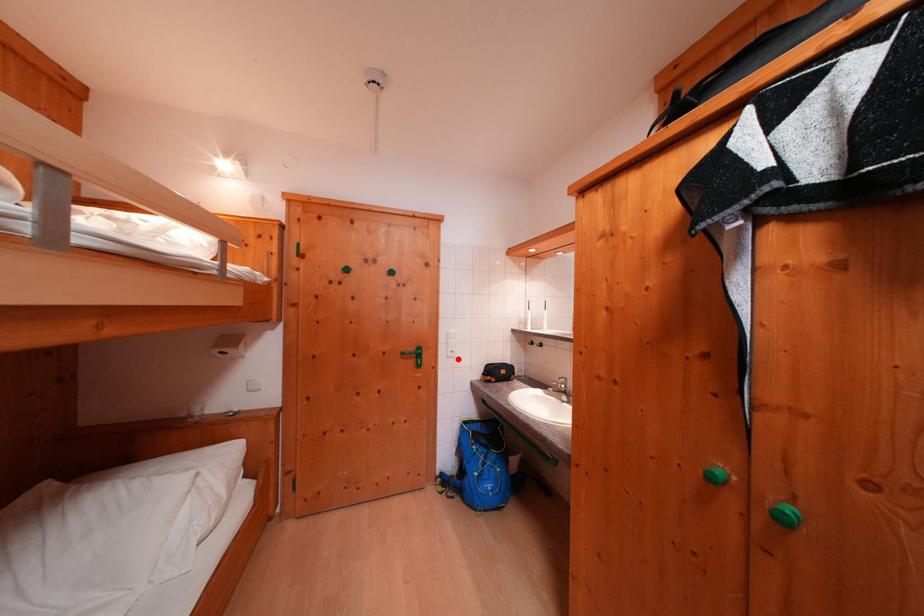
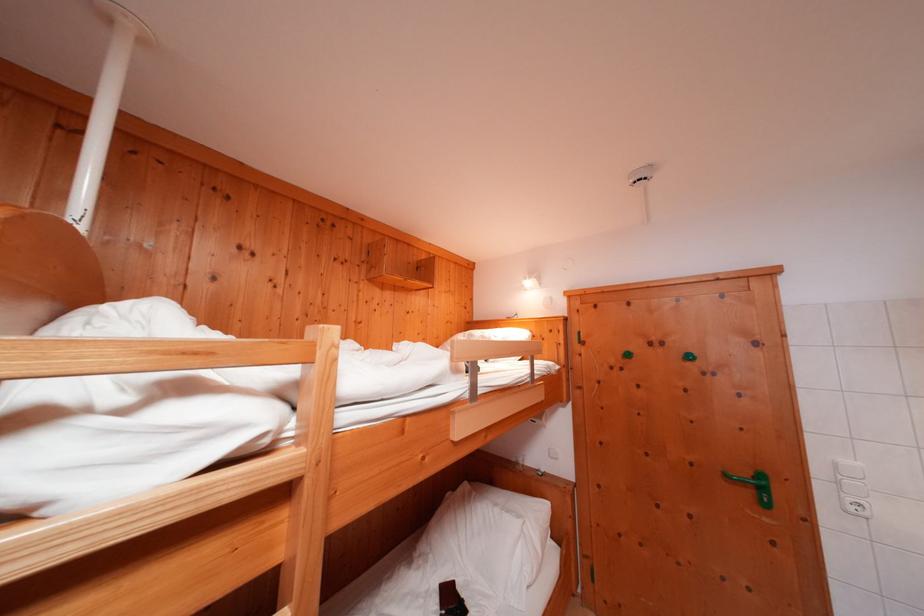
Find the pixel in the second image that matches the highlighted location in the first image.

(858, 513)